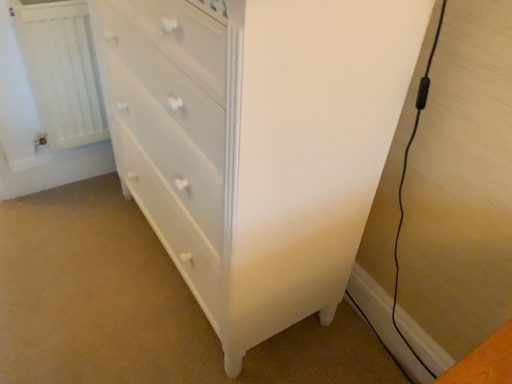
Identify the location of white painted radiator at left. This screenshot has height=384, width=512. (61, 71).

Describe the element at coordinates (61, 71) in the screenshot. I see `white painted radiator at left` at that location.

In order to face white painted wood chest of drawers at center, should I rotate leftwards or rightwards?

Rotate left and turn 5.659 degrees.

Describe the element at coordinates (257, 143) in the screenshot. I see `white painted wood chest of drawers at center` at that location.

At what (x,y) coordinates should I click in order to perform the action: click on white painted wood chest of drawers at center. Please return your answer as a coordinate pair (x, y). This screenshot has width=512, height=384. Looking at the image, I should click on (257, 143).

The height and width of the screenshot is (384, 512). I want to click on white painted radiator at left, so click(x=61, y=71).

Between white painted wood chest of drawers at center and white painted radiator at left, which one appears on the left side from the viewer's perspective?

Positioned to the left is white painted radiator at left.

Does white painted wood chest of drawers at center lie behind white painted radiator at left?

No, the depth of white painted wood chest of drawers at center is less than that of white painted radiator at left.

Is point (421, 36) farther from viewer compared to point (85, 22)?

That is False.

From the image's perspective, is white painted wood chest of drawers at center positioned above or below white painted radiator at left?

white painted wood chest of drawers at center is situated lower than white painted radiator at left in the image.

From a real-world perspective, is white painted wood chest of drawers at center located higher than white painted radiator at left?

Correct, in the physical world, white painted wood chest of drawers at center is higher than white painted radiator at left.

Considering the relative sizes of white painted wood chest of drawers at center and white painted radiator at left in the image provided, is white painted wood chest of drawers at center thinner than white painted radiator at left?

No.

Considering the sizes of objects white painted wood chest of drawers at center and white painted radiator at left in the image provided, who is shorter, white painted wood chest of drawers at center or white painted radiator at left?

white painted radiator at left is shorter.

Can you confirm if white painted wood chest of drawers at center is bigger than white painted radiator at left?

Yes.

Is white painted wood chest of drawers at center completely or partially outside of white painted radiator at left?

Yes, white painted wood chest of drawers at center is outside of white painted radiator at left.

Is white painted wood chest of drawers at center in contact with white painted radiator at left?

No, white painted wood chest of drawers at center is not with white painted radiator at left.

Is white painted wood chest of drawers at center oriented towards white painted radiator at left?

No, white painted wood chest of drawers at center is not facing towards white painted radiator at left.

Can you tell me how much white painted wood chest of drawers at center and white painted radiator at left differ in facing direction?

There is a 90.9-degree angle between the facing directions of white painted wood chest of drawers at center and white painted radiator at left.

Where is `the chest of drawers that is above the white painted radiator at left (from a real-world perspective)`? The image size is (512, 384). the chest of drawers that is above the white painted radiator at left (from a real-world perspective) is located at coordinates (257, 143).

Looking at this image, considering the positions of objects white painted radiator at left and white painted wood chest of drawers at center in the image provided, who is more to the right, white painted radiator at left or white painted wood chest of drawers at center?

Positioned to the right is white painted wood chest of drawers at center.

Is white painted radiator at left in front of or behind white painted wood chest of drawers at center in the image?

Clearly, white painted radiator at left is behind white painted wood chest of drawers at center.

Is point (85, 22) behind point (170, 192)?

That is True.

From the image's perspective, is white painted radiator at left above white painted wood chest of drawers at center?

Indeed, from the image's perspective, white painted radiator at left is shown above white painted wood chest of drawers at center.

From a real-world perspective, is white painted radiator at left physically above white painted wood chest of drawers at center?

No, from a real-world perspective, white painted radiator at left is not on top of white painted wood chest of drawers at center.

Is white painted radiator at left thinner than white painted wood chest of drawers at center?

Indeed, white painted radiator at left has a lesser width compared to white painted wood chest of drawers at center.

Considering the relative sizes of white painted radiator at left and white painted wood chest of drawers at center in the image provided, is white painted radiator at left taller than white painted wood chest of drawers at center?

No.

In the scene shown: Considering the sizes of objects white painted radiator at left and white painted wood chest of drawers at center in the image provided, who is smaller, white painted radiator at left or white painted wood chest of drawers at center?

white painted radiator at left.

Which is correct: white painted radiator at left is inside white painted wood chest of drawers at center, or outside of it?

white painted radiator at left is not inside white painted wood chest of drawers at center, it's outside.

Is white painted radiator at left far from white painted wood chest of drawers at center?

No, white painted radiator at left is in close proximity to white painted wood chest of drawers at center.

Could you tell me if white painted radiator at left is turned towards white painted wood chest of drawers at center?

No.

Measure the distance between white painted radiator at left and white painted wood chest of drawers at center.

white painted radiator at left and white painted wood chest of drawers at center are 61.80 centimeters apart from each other.

Identify the location of radiator on the left side of white painted wood chest of drawers at center. (61, 71).

There is a white painted radiator at left. At what (x,y) coordinates should I click in order to perform the action: click on the chest of drawers above it (from a real-world perspective). Please return your answer as a coordinate pair (x, y). The width and height of the screenshot is (512, 384). Looking at the image, I should click on (257, 143).

The image size is (512, 384). Find the location of `radiator on the left of white painted wood chest of drawers at center`. radiator on the left of white painted wood chest of drawers at center is located at coordinates (61, 71).